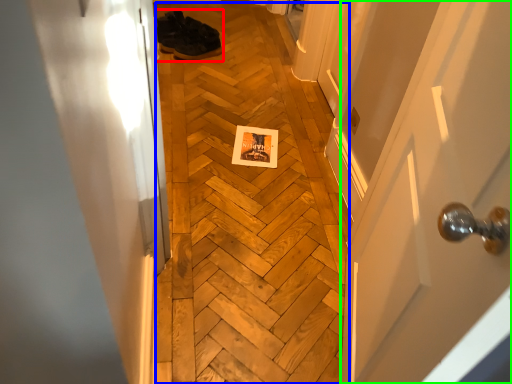
Question: Which is nearer to the footwear (highlighted by a red box)? plywood (highlighted by a blue box) or door (highlighted by a green box).

Choices:
 (A) plywood
 (B) door

Answer: (A)